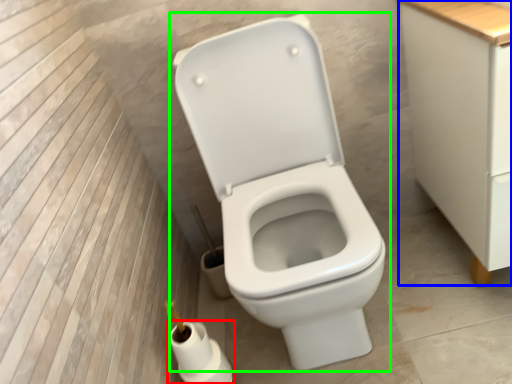
Question: Which object is the farthest from toilet paper (highlighted by a red box)? Choose among these: cabinetry (highlighted by a blue box) or toilet (highlighted by a green box).

Choices:
 (A) cabinetry
 (B) toilet

Answer: (A)